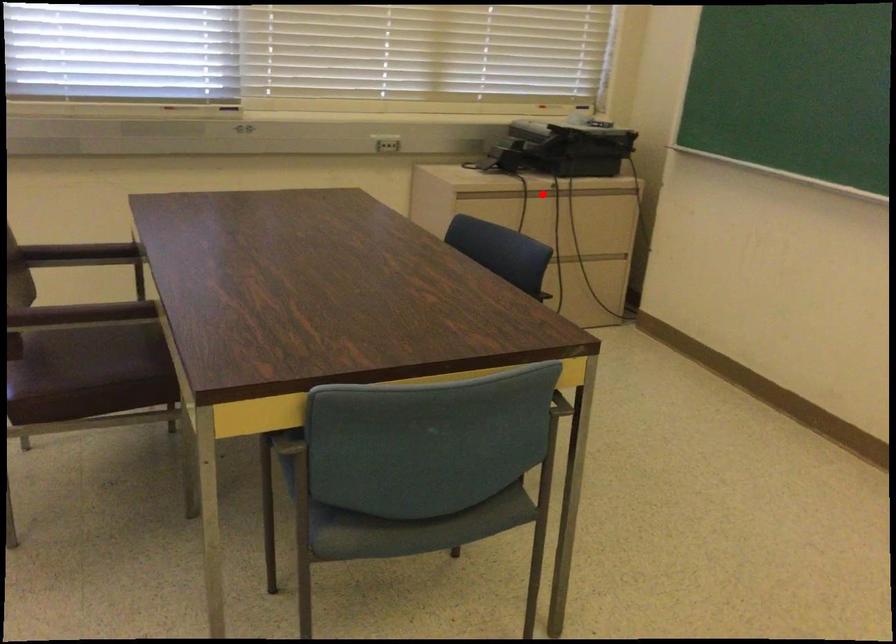
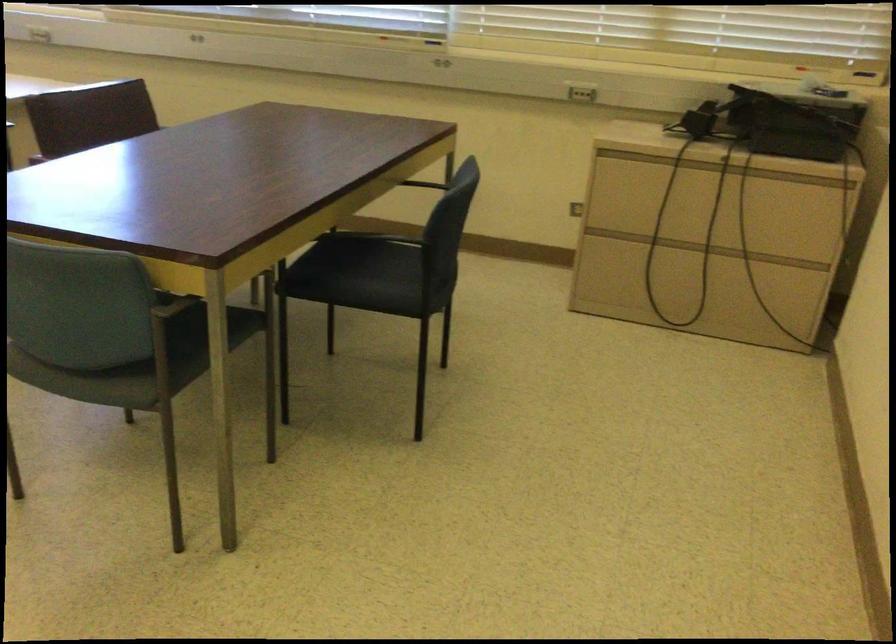
Where in the second image is the point corresponding to the highlighted location from the first image?

(700, 167)